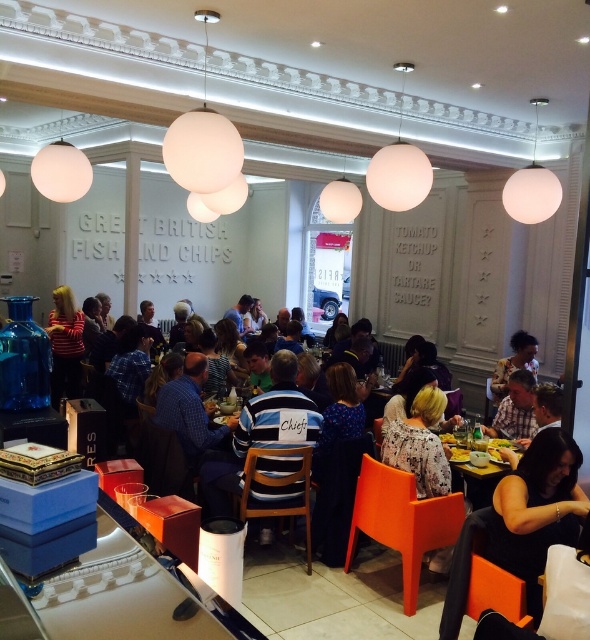
Question: Which object is farther from the camera taking this photo?

Choices:
 (A) matte striped shirt at center
 (B) yellow plastic table at center
 (C) floral-patterned blouse at center

Answer: (C)

Question: Can you confirm if matte striped shirt at center is smaller than yellow plastic table at center?

Choices:
 (A) yes
 (B) no

Answer: (B)

Question: Does matte striped shirt at center lie behind floral-patterned blouse at center?

Choices:
 (A) yes
 (B) no

Answer: (B)

Question: Considering the real-world distances, which object is farthest from the floral-patterned blouse at center?

Choices:
 (A) matte striped shirt at center
 (B) yellow plastic table at center

Answer: (B)

Question: Estimate the real-world distances between objects in this image. Which object is closer to the matte striped shirt at center?

Choices:
 (A) floral-patterned blouse at center
 (B) yellow plastic table at center

Answer: (B)

Question: Is matte striped shirt at center to the left of floral-patterned blouse at center from the viewer's perspective?

Choices:
 (A) yes
 (B) no

Answer: (A)